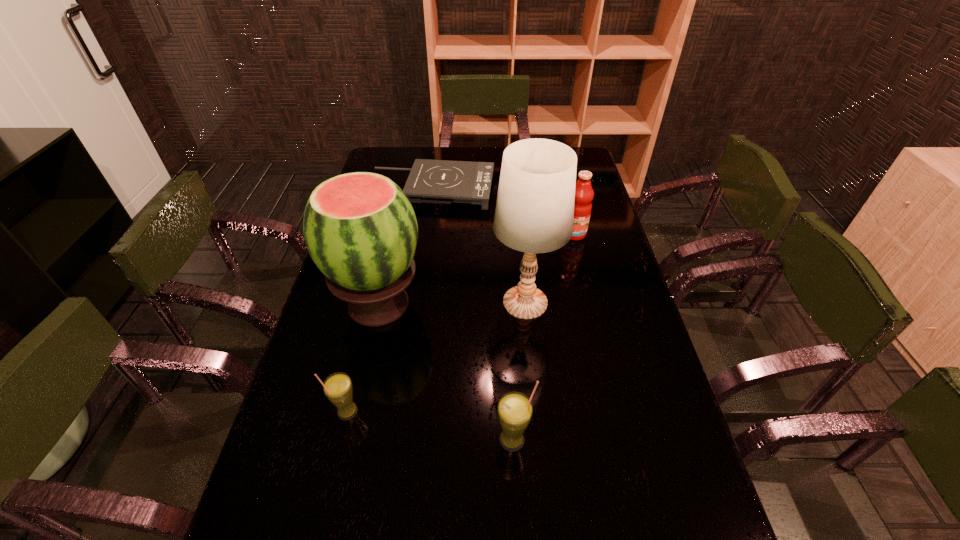
Identify the location of vacant space that satisfies the following two spatial constraints: 1. on the back side of the watermelon; 2. on the right side of the lamp. This screenshot has width=960, height=540. pyautogui.click(x=379, y=302).

The height and width of the screenshot is (540, 960). I want to click on free space in the image that satisfies the following two spatial constraints: 1. on the back side of the left straw for drinking; 2. on the left side of the tallest object, so click(373, 302).

At what (x,y) coordinates should I click in order to perform the action: click on vacant space that satisfies the following two spatial constraints: 1. on the front side of the taller straw for drinking; 2. on the left side of the fifth shortest object. Please return your answer as a coordinate pair (x, y). This screenshot has height=540, width=960. Looking at the image, I should click on (348, 440).